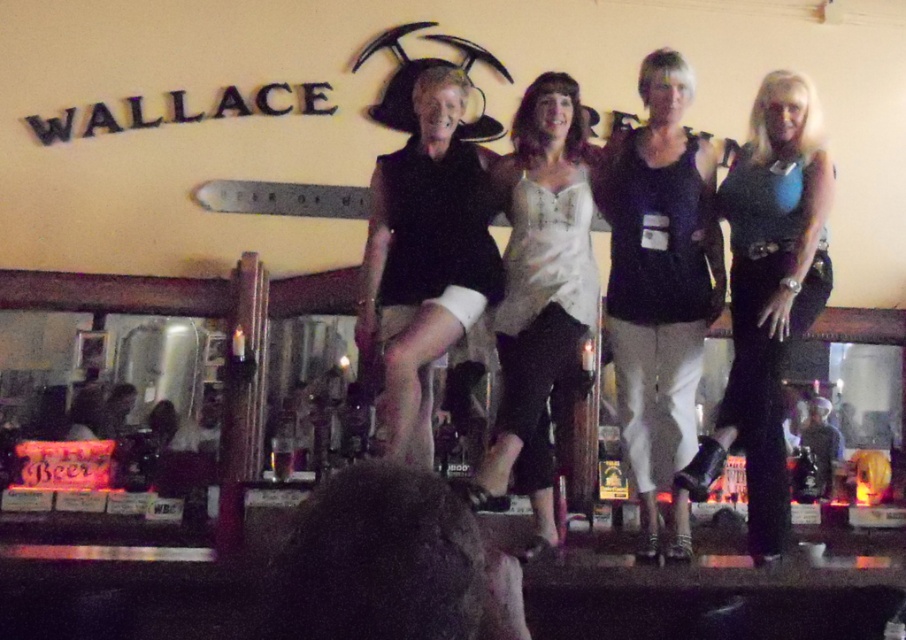
You are a photographer trying to capture a clear shot of both the black matte vest at center and the dark brown leather jacket at center. Since you can only focus on one at a time, which one should you focus on to ensure the other is still somewhat in focus?

The black matte vest at center is above the dark brown leather jacket at center, so focusing on the black matte vest at center will keep the dark brown leather jacket at center in better focus since it is closer to the camera.

You are a photographer trying to capture a clear shot of both the matte black shirt at center and the white lace blouse at center. Given their sizes in the image, which one might require you to zoom in more to ensure it fills the frame adequately?

The matte black shirt at center occupies less space than the white lace blouse at center, so you would need to zoom in more on the matte black shirt at center to fill the frame since it is smaller in the image.